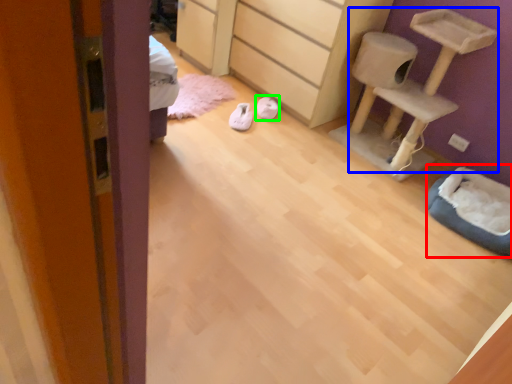
Question: Which object is the farthest from cat bed (highlighted by a red box)? Choose among these: furniture (highlighted by a blue box) or footwear (highlighted by a green box).

Choices:
 (A) furniture
 (B) footwear

Answer: (B)